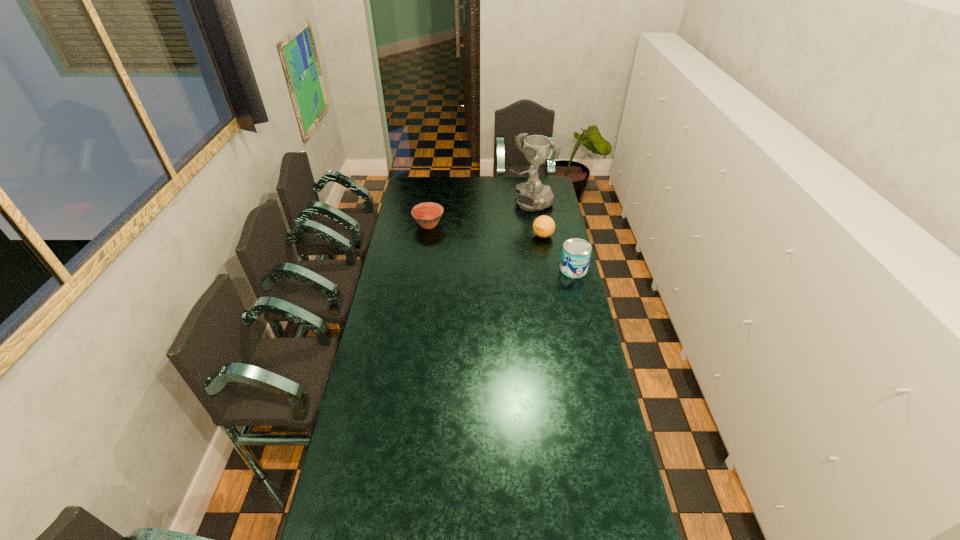
I want to click on bowl, so click(427, 214).

I want to click on the shortest object, so click(x=427, y=214).

Where is `can`? This screenshot has width=960, height=540. can is located at coordinates (576, 252).

At what (x,y) coordinates should I click in order to perform the action: click on the nearest object. Please return your answer as a coordinate pair (x, y). This screenshot has height=540, width=960. Looking at the image, I should click on (576, 252).

Where is `award`? award is located at coordinates (532, 195).

Where is `the farthest object`? This screenshot has height=540, width=960. the farthest object is located at coordinates (532, 195).

Locate an element on the screen. This screenshot has width=960, height=540. ping-pong ball is located at coordinates (543, 226).

This screenshot has height=540, width=960. I want to click on vacant space located 0.300m on the right of the leftmost object, so click(499, 225).

What are the coordinates of `free space located 0.190m on the left of the second tallest object` in the screenshot? It's located at coord(521,269).

The width and height of the screenshot is (960, 540). What are the coordinates of `free location located 0.370m on the side with emblem of the tallest object` in the screenshot? It's located at (482, 244).